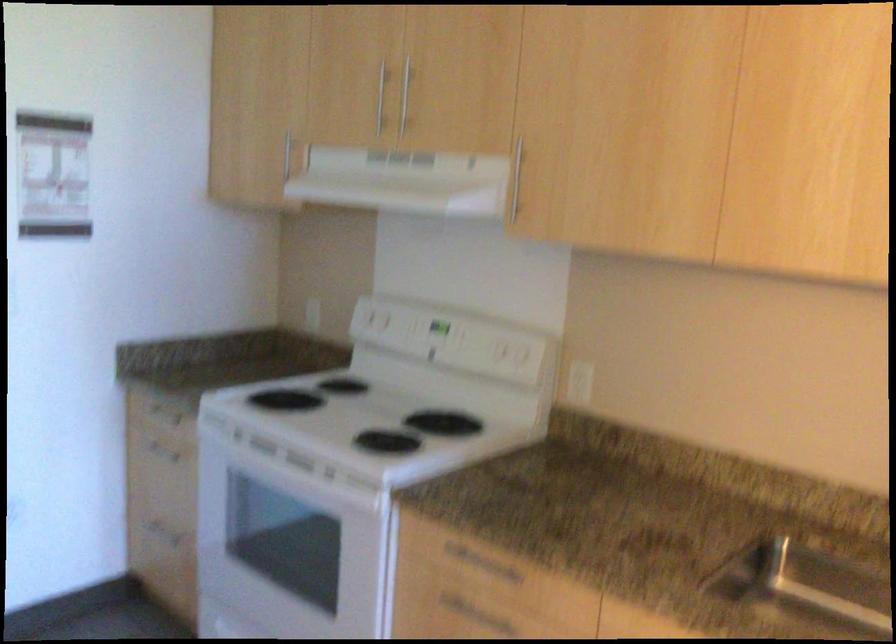
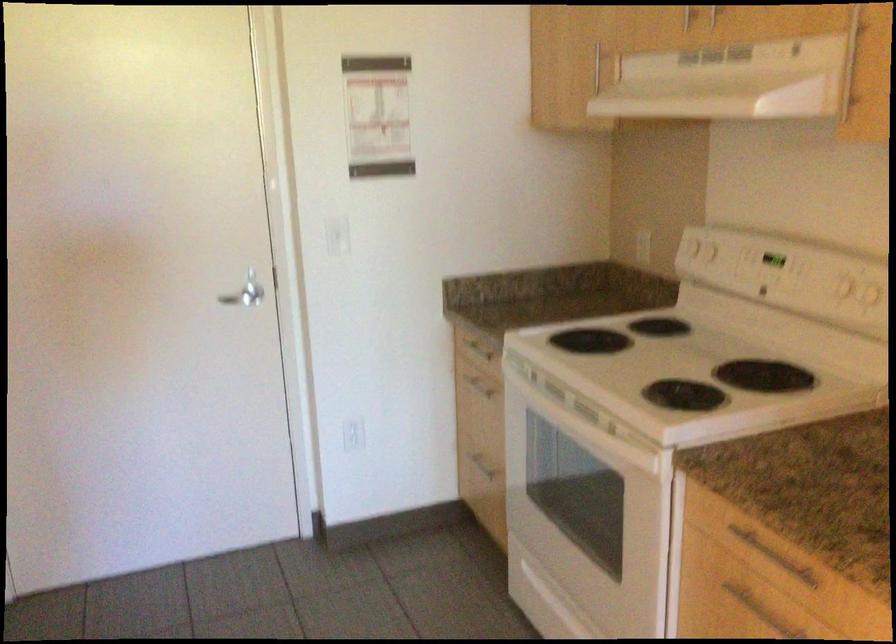
Question: The camera is either moving clockwise (left) or counter-clockwise (right) around the object. The first image is from the beginning of the video and the second image is from the end. Is the camera moving left or right when shooting the video?

Choices:
 (A) Left
 (B) Right

Answer: (B)